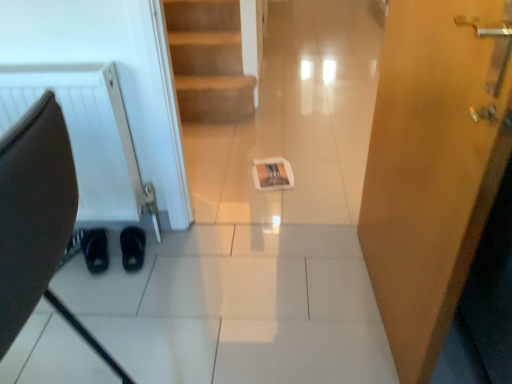
Where is `vacant space underneath black suede shoes at lower left, which is the 2th footwear in right-to-left order (from a real-world perspective)`? vacant space underneath black suede shoes at lower left, which is the 2th footwear in right-to-left order (from a real-world perspective) is located at coordinates [95, 257].